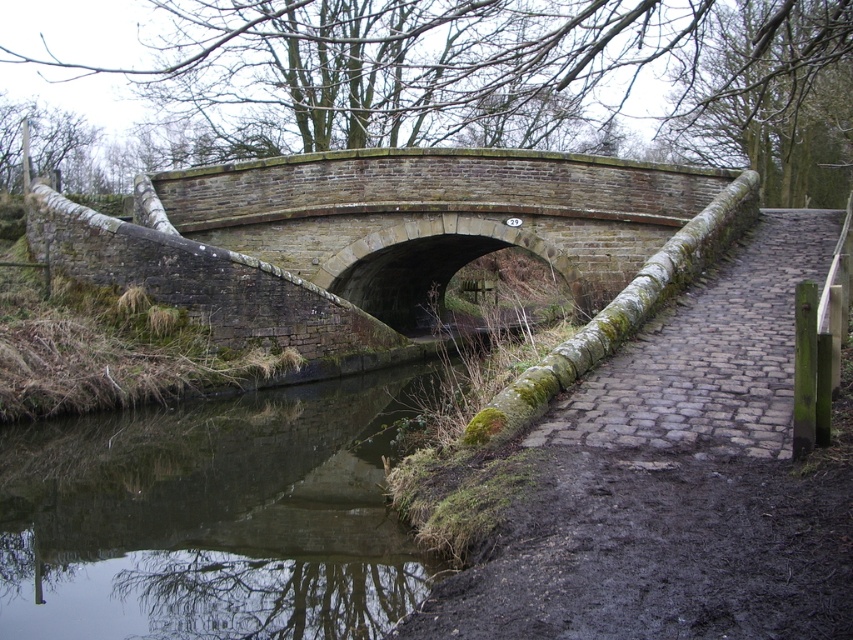
Is brick stone bridge at center closer to the viewer compared to green mossy water at lower left?

No.

Is point (491, 196) positioned after point (251, 509)?

Yes, point (491, 196) is behind point (251, 509).

The height and width of the screenshot is (640, 853). Identify the location of brick stone bridge at center. (393, 236).

Is brick stone bridge at center behind gray cobblestone path at center?

Yes.

Who is more forward, [431,268] or [740,336]?

Point [740,336]

Where is `brick stone bridge at center`? brick stone bridge at center is located at coordinates [393, 236].

Can you confirm if green mossy water at lower left is positioned to the left of gray cobblestone path at center?

Indeed, green mossy water at lower left is positioned on the left side of gray cobblestone path at center.

Based on the photo, does green mossy water at lower left have a greater width compared to gray cobblestone path at center?

No.

The height and width of the screenshot is (640, 853). I want to click on green mossy water at lower left, so click(x=212, y=516).

Image resolution: width=853 pixels, height=640 pixels. What are the coordinates of `green mossy water at lower left` in the screenshot? It's located at click(212, 516).